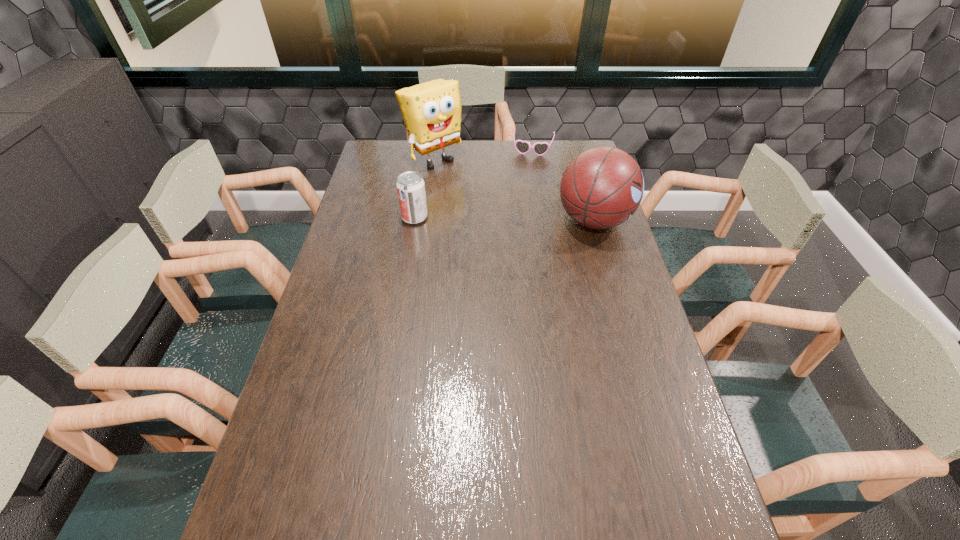
Where is `vacant space at the near edge of the desktop`? This screenshot has width=960, height=540. vacant space at the near edge of the desktop is located at coordinates (429, 508).

Where is `vacant point at the left edge`? vacant point at the left edge is located at coordinates (271, 459).

Identify the location of free space at the right edge of the desktop. Image resolution: width=960 pixels, height=540 pixels. (650, 412).

Locate an element on the screen. This screenshot has width=960, height=540. free space at the far left corner is located at coordinates (396, 141).

In order to click on free region at the near left corner of the desktop in this screenshot , I will do pos(316,481).

Locate an element on the screen. The width and height of the screenshot is (960, 540). vacant space that's between the soda can and the basketball is located at coordinates pyautogui.click(x=504, y=219).

At what (x,y) coordinates should I click in order to perform the action: click on empty location between the sponge and the sunglasses. Please return your answer as a coordinate pair (x, y). This screenshot has width=960, height=540. Looking at the image, I should click on (484, 154).

Locate an element on the screen. unoccupied position between the tallest object and the second tallest object is located at coordinates (514, 190).

The width and height of the screenshot is (960, 540). In order to click on vacant area that lies between the second shortest object and the second tallest object in this screenshot , I will do [x=504, y=219].

This screenshot has height=540, width=960. Identify the location of unoccupied position between the sponge and the sunglasses. (484, 154).